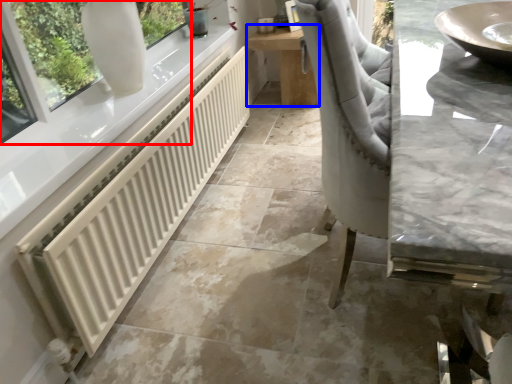
Question: Among these objects, which one is farthest to the camera, window (highlighted by a red box) or table (highlighted by a blue box)?

Choices:
 (A) window
 (B) table

Answer: (B)